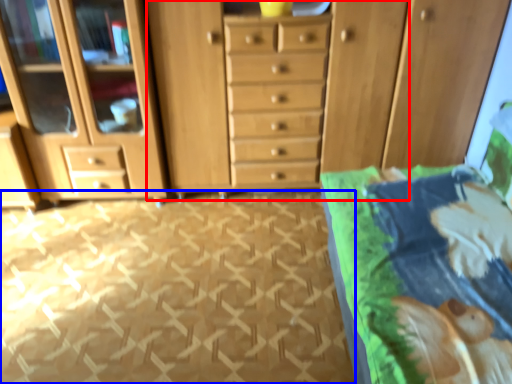
Question: Which point is further to the camera, dresser (highlighted by a red box) or tile (highlighted by a blue box)?

Choices:
 (A) dresser
 (B) tile

Answer: (A)